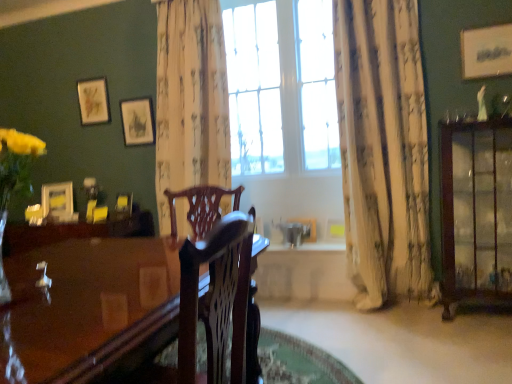
Where is `vacant space in between brown wood cabinet at right and white textured curtain at right, which appears as the 1th curtain when viewed from the right`? vacant space in between brown wood cabinet at right and white textured curtain at right, which appears as the 1th curtain when viewed from the right is located at coordinates (401, 318).